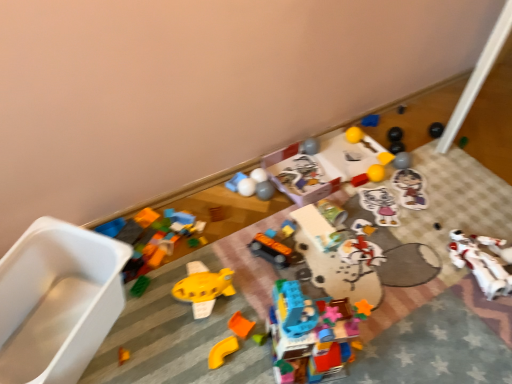
Image resolution: width=512 pixels, height=384 pixels. Identify the location of free space between matte white plush cat at center, marked as the fifth toy in a right-to-left arrangement, and white plastic container at left, the seventeenth toy when ordered from right to left. (247, 274).